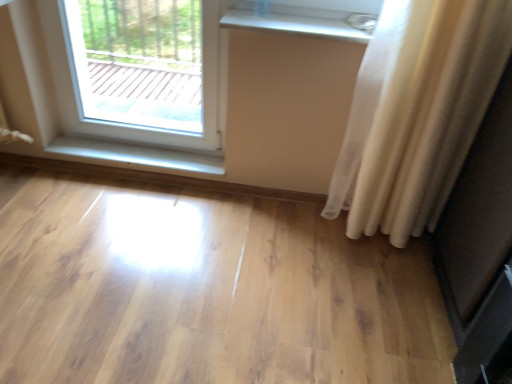
Describe the element at coordinates (294, 25) in the screenshot. I see `white glossy radiator at upper center, marked as the 2th window sill in a left-to-right arrangement` at that location.

Measure the distance between point (345,34) and camera.

Point (345,34) is 5.42 feet away from camera.

Image resolution: width=512 pixels, height=384 pixels. Find the location of `clear glass window at upper left`. clear glass window at upper left is located at coordinates (137, 69).

The image size is (512, 384). What do you see at coordinates (205, 290) in the screenshot?
I see `light wood floor at center` at bounding box center [205, 290].

What do you see at coordinates (478, 215) in the screenshot? I see `matte black screen door at right` at bounding box center [478, 215].

Describe the element at coordinates (417, 112) in the screenshot. I see `white sheer curtain at right` at that location.

Image resolution: width=512 pixels, height=384 pixels. What are the coordinates of `white glossy radiator at upper center, positioned as the second window sill in back-to-front order` in the screenshot? It's located at (294, 25).

Does white sheer curtain at right turn towards white glossy wood at lower left, the first window sill ordered from the bottom?

No, white sheer curtain at right is not facing towards white glossy wood at lower left, the first window sill ordered from the bottom.

From the image's perspective, is white sheer curtain at right located above or below white glossy wood at lower left, which appears as the 1th window sill when viewed from the back?

From the image's perspective, white sheer curtain at right appears above white glossy wood at lower left, which appears as the 1th window sill when viewed from the back.

Are white sheer curtain at right and white glossy wood at lower left, which is counted as the 2th window sill, starting from the top, beside each other?

white sheer curtain at right is not next to white glossy wood at lower left, which is counted as the 2th window sill, starting from the top, and they're not touching.

Is point (413, 132) closer or farther from the camera than point (187, 152)?

Point (413, 132).

Is white glossy radiator at upper center, placed as the 1th window sill when sorted from top to bottom, turned away from white sheer curtain at right?

No, white glossy radiator at upper center, placed as the 1th window sill when sorted from top to bottom, is not facing the opposite direction of white sheer curtain at right.

Considering their positions, is white glossy radiator at upper center, placed as the 1th window sill when sorted from top to bottom, located in front of or behind white sheer curtain at right?

In the image, white glossy radiator at upper center, placed as the 1th window sill when sorted from top to bottom, appears behind white sheer curtain at right.

In the scene shown: Looking at the image, does white glossy radiator at upper center, the second window sill when ordered from bottom to top, seem bigger or smaller compared to white sheer curtain at right?

Considering their sizes, white glossy radiator at upper center, the second window sill when ordered from bottom to top, takes up less space than white sheer curtain at right.

Is white glossy radiator at upper center, the second window sill when ordered from bottom to top, inside the boundaries of white sheer curtain at right, or outside?

white glossy radiator at upper center, the second window sill when ordered from bottom to top, lies outside white sheer curtain at right.

Visually, is white sheer curtain at right positioned to the left or to the right of white glossy radiator at upper center, marked as the 2th window sill in a left-to-right arrangement?

In the image, white sheer curtain at right appears on the right side of white glossy radiator at upper center, marked as the 2th window sill in a left-to-right arrangement.

Who is more distant, white sheer curtain at right or white glossy radiator at upper center, positioned as the second window sill in back-to-front order?

white glossy radiator at upper center, positioned as the second window sill in back-to-front order, is more distant.

Is white sheer curtain at right facing away from white glossy radiator at upper center, the first window sill positioned from the front?

No, white sheer curtain at right is not facing the opposite direction of white glossy radiator at upper center, the first window sill positioned from the front.

From the picture: Which is nearer, (x=418, y=126) or (x=267, y=13)?

Positioned in front is point (x=418, y=126).

Based on the photo, considering the sizes of objects clear glass window at upper left and white glossy radiator at upper center, the first window sill positioned from the right, in the image provided, who is thinner, clear glass window at upper left or white glossy radiator at upper center, the first window sill positioned from the right,?

clear glass window at upper left is thinner.

Looking at this image, considering the relative positions of clear glass window at upper left and white glossy radiator at upper center, marked as the 2th window sill in a left-to-right arrangement, in the image provided, is clear glass window at upper left to the left or to the right of white glossy radiator at upper center, marked as the 2th window sill in a left-to-right arrangement,?

Clearly, clear glass window at upper left is on the left of white glossy radiator at upper center, marked as the 2th window sill in a left-to-right arrangement, in the image.

Identify the location of window on the left of white glossy radiator at upper center, positioned as the second window sill in back-to-front order. (137, 69).

From a real-world perspective, which is physically above, clear glass window at upper left or white glossy radiator at upper center, the first window sill positioned from the front?

white glossy radiator at upper center, the first window sill positioned from the front.

Is white sheer curtain at right thinner than light wood floor at center?

Yes, white sheer curtain at right is thinner than light wood floor at center.

Where is `plain that is under the white sheer curtain at right (from a real-world perspective)`? The width and height of the screenshot is (512, 384). plain that is under the white sheer curtain at right (from a real-world perspective) is located at coordinates (205, 290).

How far apart are white sheer curtain at right and light wood floor at center?

white sheer curtain at right and light wood floor at center are 25.21 inches apart.

How far apart are matte black screen door at right and white sheer curtain at right?

A distance of 26.14 centimeters exists between matte black screen door at right and white sheer curtain at right.

Could you tell me if matte black screen door at right is facing white sheer curtain at right?

No, matte black screen door at right is not facing towards white sheer curtain at right.

How different are the orientations of matte black screen door at right and white sheer curtain at right in degrees?

88.2 degrees.

Is matte black screen door at right positioned behind white sheer curtain at right?

No, matte black screen door at right is in front of white sheer curtain at right.

Considering the positions of objects white glossy wood at lower left, which is counted as the 2th window sill, starting from the top, and light wood floor at center in the image provided, who is behind, white glossy wood at lower left, which is counted as the 2th window sill, starting from the top, or light wood floor at center?

white glossy wood at lower left, which is counted as the 2th window sill, starting from the top, is more distant.

From the image's perspective, is white glossy wood at lower left, which is counted as the 2th window sill, starting from the top, on top of light wood floor at center?

Indeed, from the image's perspective, white glossy wood at lower left, which is counted as the 2th window sill, starting from the top, is shown above light wood floor at center.

Is white glossy wood at lower left, which is the second window sill in front-to-back order, far away from light wood floor at center?

white glossy wood at lower left, which is the second window sill in front-to-back order, is near light wood floor at center, not far away.

Considering the relative positions of white glossy wood at lower left, which appears as the 1th window sill when viewed from the back, and light wood floor at center in the image provided, is white glossy wood at lower left, which appears as the 1th window sill when viewed from the back, to the left or to the right of light wood floor at center?

Based on their positions, white glossy wood at lower left, which appears as the 1th window sill when viewed from the back, is located to the left of light wood floor at center.

Find the location of a particular element. curtain above the white glossy wood at lower left, acting as the 2th window sill starting from the right (from the image's perspective) is located at coordinates (417, 112).

This screenshot has height=384, width=512. What are the coordinates of `window sill that is the 1st object to the left of the white sheer curtain at right, starting at the anchor` in the screenshot? It's located at (294, 25).

Estimate the real-world distances between objects in this image. Which object is further from matte black screen door at right, white sheer curtain at right or white glossy radiator at upper center, marked as the 2th window sill in a left-to-right arrangement?

white glossy radiator at upper center, marked as the 2th window sill in a left-to-right arrangement, lies further to matte black screen door at right than the other object.

Which object lies nearer to the anchor point clear glass window at upper left, white glossy radiator at upper center, marked as the 2th window sill in a left-to-right arrangement, or white sheer curtain at right?

white glossy radiator at upper center, marked as the 2th window sill in a left-to-right arrangement.

When comparing their distances from matte black screen door at right, does light wood floor at center or clear glass window at upper left seem closer?

light wood floor at center is positioned closer to the anchor matte black screen door at right.

Based on their spatial positions, is white glossy wood at lower left, acting as the 2th window sill starting from the right, or clear glass window at upper left further from white sheer curtain at right?

The object further to white sheer curtain at right is clear glass window at upper left.

From the image, which object appears to be farther from white sheer curtain at right, white glossy wood at lower left, which is counted as the 1th window sill, starting from the left, or white glossy radiator at upper center, placed as the 1th window sill when sorted from top to bottom?

white glossy wood at lower left, which is counted as the 1th window sill, starting from the left.

Which object lies nearer to the anchor point matte black screen door at right, clear glass window at upper left or light wood floor at center?

light wood floor at center is positioned closer to the anchor matte black screen door at right.

In the scene shown: When comparing their distances from white glossy wood at lower left, which appears as the 1th window sill when viewed from the back, does white glossy radiator at upper center, placed as the 1th window sill when sorted from top to bottom, or clear glass window at upper left seem further?

white glossy radiator at upper center, placed as the 1th window sill when sorted from top to bottom.

Looking at this image, when comparing their distances from white glossy radiator at upper center, positioned as the second window sill in back-to-front order, does clear glass window at upper left or matte black screen door at right seem further?

The object further to white glossy radiator at upper center, positioned as the second window sill in back-to-front order, is clear glass window at upper left.

The height and width of the screenshot is (384, 512). Identify the location of curtain between white glossy radiator at upper center, placed as the 1th window sill when sorted from top to bottom, and matte black screen door at right, in the horizontal direction. (417, 112).

You are a GUI agent. You are given a task and a screenshot of the screen. Output one action in this format:
    pyautogui.click(x=<x>, y=<y>)
    Task: Click on the curtain between light wood floor at center and matte black screen door at right in the horizontal direction
    
    Given the screenshot: What is the action you would take?
    pyautogui.click(x=417, y=112)

Locate an element on the screen. The height and width of the screenshot is (384, 512). window sill between clear glass window at upper left and matte black screen door at right is located at coordinates (294, 25).

The height and width of the screenshot is (384, 512). Find the location of `window situated between white glossy wood at lower left, which is the second window sill in front-to-back order, and white glossy radiator at upper center, marked as the 2th window sill in a left-to-right arrangement, from left to right`. window situated between white glossy wood at lower left, which is the second window sill in front-to-back order, and white glossy radiator at upper center, marked as the 2th window sill in a left-to-right arrangement, from left to right is located at coordinates (137, 69).